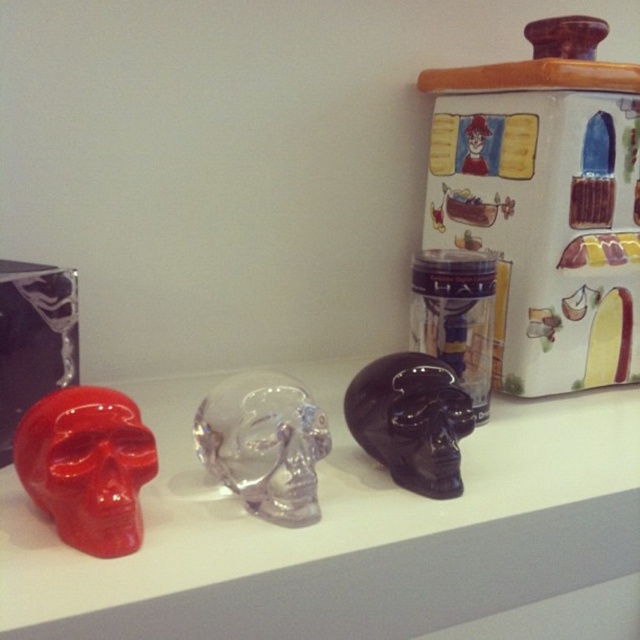
You are standing in front of the shelf and want to place a new decorative item between the two points labeled point (x=556, y=188) and point (x=426, y=476). Based on their positions, which point should the new item be closer to?

The new item should be closer to point (x=426, y=476) because point (x=556, y=188) is behind it.

You are standing in front of the shelf and want to place a small sticker on the shelf. The sticker can only be placed in front of the point at [147,433]. Can you place the sticker at the point at [451,74]?

Point [451,74] is behind point [147,433], so placing the sticker there would not be in front of the specified point. Choose a location in front of point [147,433] instead.